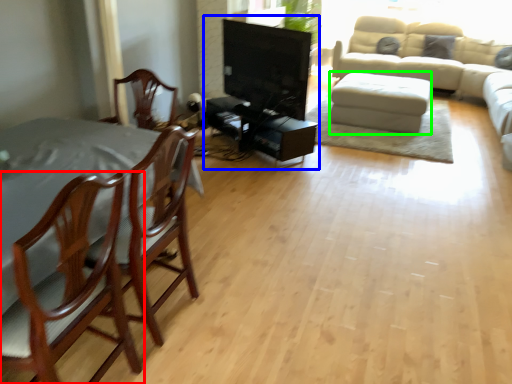
Question: Which object is positioned closest to chair (highlighted by a red box)? Select from entertainment center (highlighted by a blue box) and footrest (highlighted by a green box).

Choices:
 (A) entertainment center
 (B) footrest

Answer: (A)